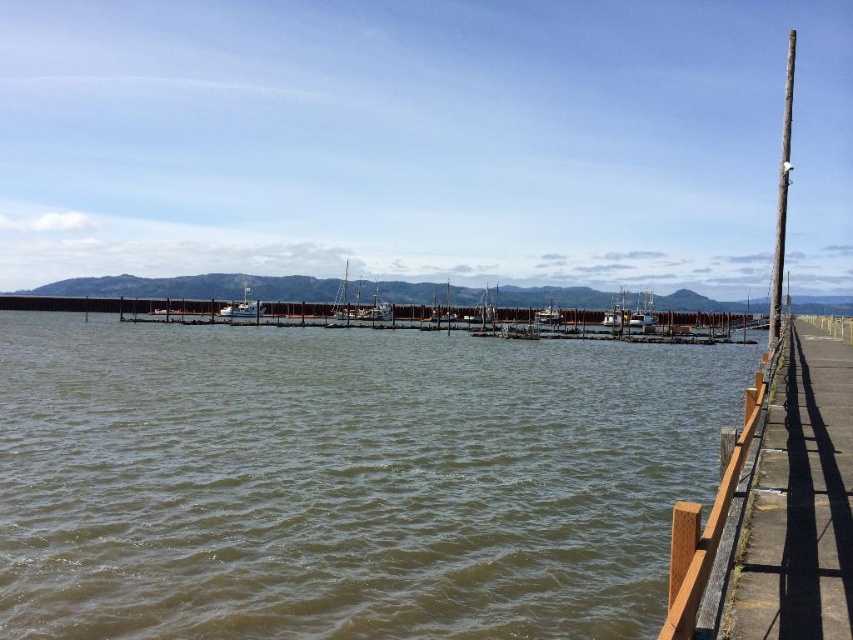
Does brown water at center have a larger size compared to dark brown wooden pole at right?

Actually, brown water at center might be smaller than dark brown wooden pole at right.

Who is positioned more to the left, brown water at center or dark brown wooden pole at right?

brown water at center

Is point (318, 502) positioned in front of point (780, 196)?

That is True.

I want to click on brown water at center, so click(x=345, y=481).

The image size is (853, 640). What do you see at coordinates (781, 196) in the screenshot?
I see `dark brown wooden pole at right` at bounding box center [781, 196].

Can you confirm if dark brown wooden pole at right is positioned to the right of white wooden boat at center?

Indeed, dark brown wooden pole at right is positioned on the right side of white wooden boat at center.

Between point (785, 102) and point (251, 314), which one is positioned behind?

The point (785, 102) is behind.

You are a GUI agent. You are given a task and a screenshot of the screen. Output one action in this format:
    pyautogui.click(x=<x>, y=<y>)
    Task: Click on the dark brown wooden pole at right
    This screenshot has height=640, width=853.
    Given the screenshot: What is the action you would take?
    pyautogui.click(x=781, y=196)

Is brown wooden dock at right positioned before dark brown wooden pole at right?

Yes.

Between point (850, 435) and point (792, 88), which one is positioned behind?

Point (792, 88)

Is point (804, 336) farther from viewer compared to point (782, 184)?

Yes, it is.

At what (x,y) coordinates should I click in order to perform the action: click on brown wooden dock at right. Please return your answer as a coordinate pair (x, y). This screenshot has width=853, height=640. Looking at the image, I should click on (775, 509).